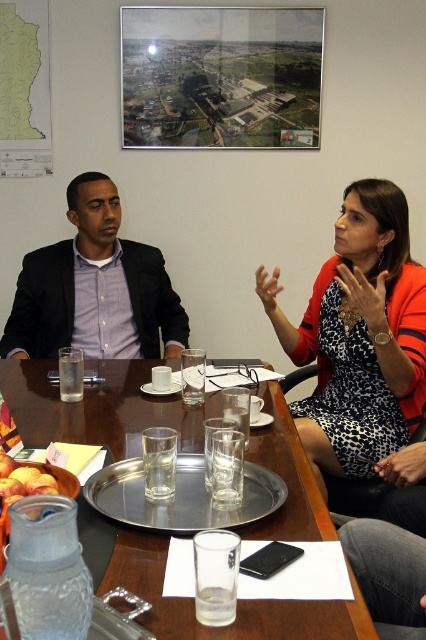
Question: Does leopard print dress at center have a smaller size compared to matte black suit at left?

Choices:
 (A) no
 (B) yes

Answer: (A)

Question: Is wooden table at center wider than matte black suit at left?

Choices:
 (A) no
 (B) yes

Answer: (B)

Question: Which point is closer to the camera?

Choices:
 (A) wooden table at center
 (B) matte black suit at left
 (C) leopard print dress at center

Answer: (A)

Question: Can you confirm if wooden table at center is positioned to the left of matte black suit at left?

Choices:
 (A) no
 (B) yes

Answer: (A)

Question: Estimate the real-world distances between objects in this image. Which object is farther from the leopard print dress at center?

Choices:
 (A) matte black suit at left
 (B) wooden table at center

Answer: (A)

Question: Among these objects, which one is farthest from the camera?

Choices:
 (A) wooden table at center
 (B) matte black suit at left
 (C) leopard print dress at center

Answer: (B)